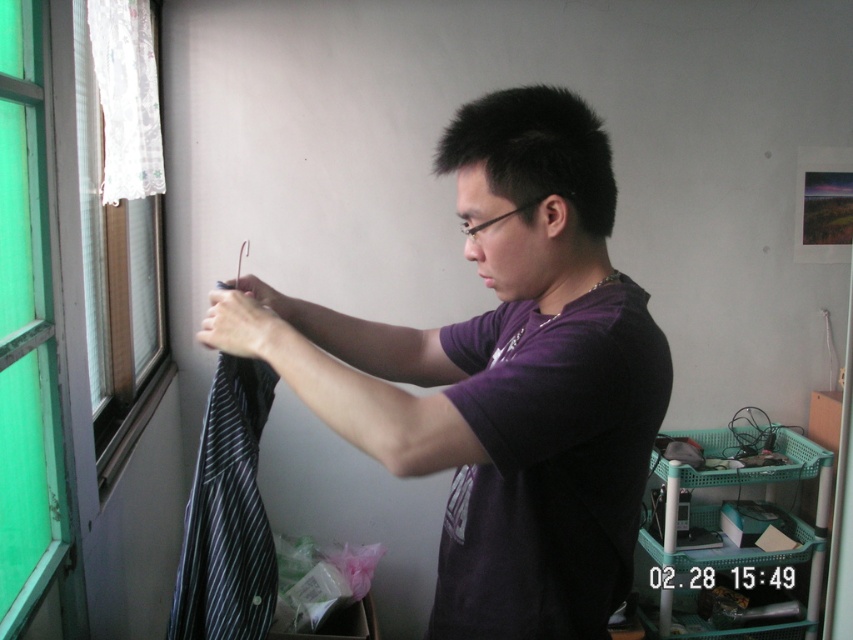
Question: Does green glass window at left have a larger size compared to black striped shirt at left?

Choices:
 (A) no
 (B) yes

Answer: (B)

Question: Is green glass window at left to the left of white lace curtain at upper left from the viewer's perspective?

Choices:
 (A) no
 (B) yes

Answer: (A)

Question: Based on their relative distances, which object is nearer to the green glass window at left?

Choices:
 (A) white lace curtain at upper left
 (B) white lace curtain at left
 (C) black striped shirt at left
 (D) purple matte shirt at center

Answer: (C)

Question: Among these points, which one is nearest to the camera?

Choices:
 (A) (100, 108)
 (B) (453, 353)
 (C) (131, 26)
 (D) (229, 369)

Answer: (D)

Question: Is purple matte shirt at center smaller than black striped shirt at left?

Choices:
 (A) yes
 (B) no

Answer: (B)

Question: Among these objects, which one is nearest to the camera?

Choices:
 (A) purple matte shirt at center
 (B) black striped shirt at left
 (C) white lace curtain at left
 (D) green glass window at left

Answer: (A)